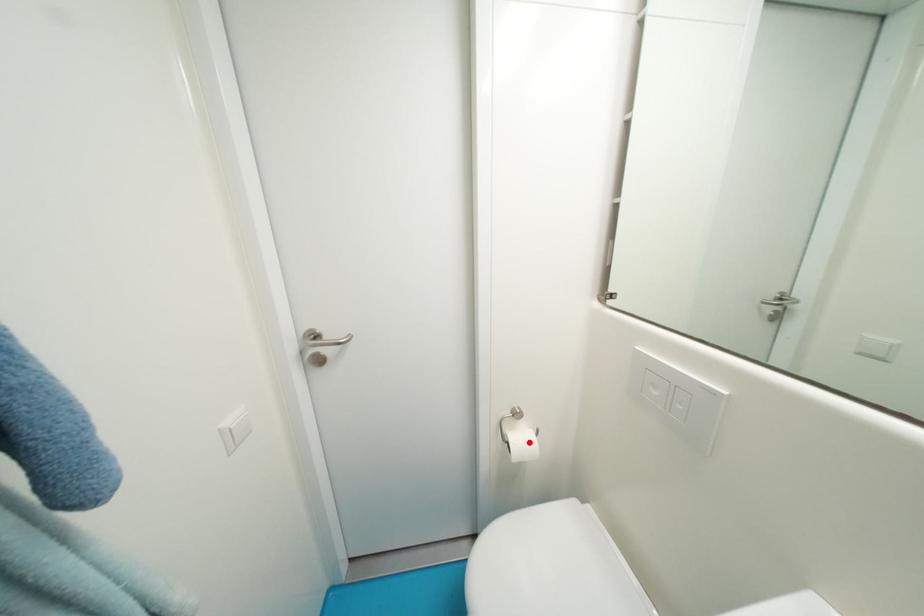
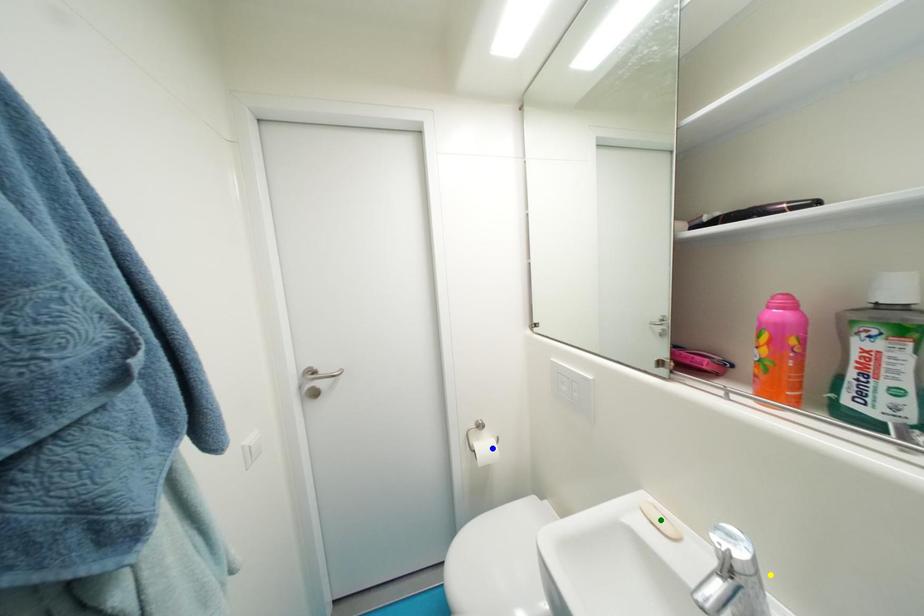
Question: I am providing you with two images of the same scene from different viewpoints. A red point is marked on the first image. You are given multiple points on the second image. Which spot in image 2 lines up with the point in image 1?

Choices:
 (A) green point
 (B) blue point
 (C) yellow point

Answer: (B)